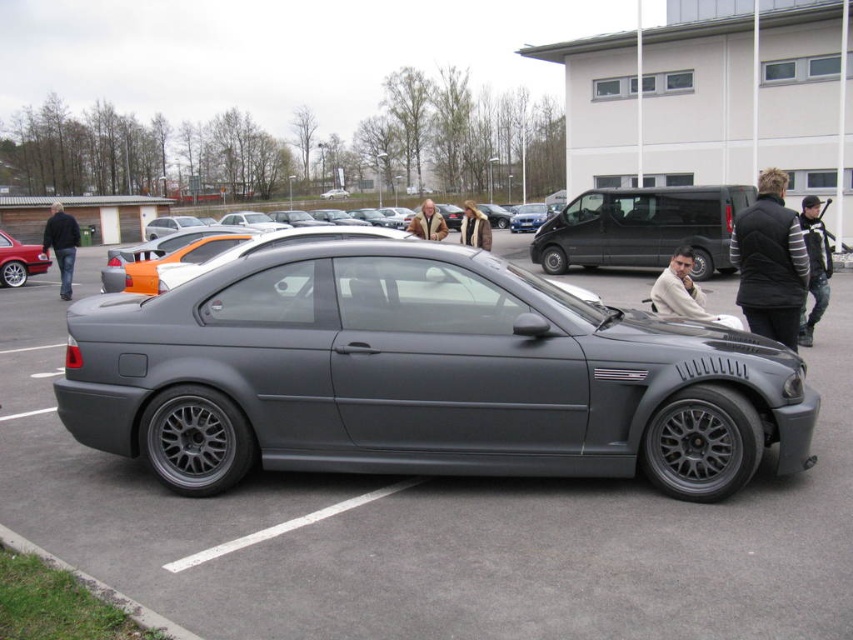
Question: Which point is farther to the camera?

Choices:
 (A) black quilted vest at right
 (B) matte black van at center
 (C) brown fur coat at center
 (D) matte gray car at center

Answer: (B)

Question: Does light beige sweater at center have a smaller size compared to matte black car at center?

Choices:
 (A) yes
 (B) no

Answer: (A)

Question: Which of these objects is positioned farthest from the black matte license plate at center?

Choices:
 (A) matte gray car at center
 (B) brown fur coat at center
 (C) striped sweater at right

Answer: (A)

Question: Which point is closer to the camera?

Choices:
 (A) black matte license plate at center
 (B) matte gray car at center
 (C) dark gray leather jacket at left
 (D) matte black van at center

Answer: (B)

Question: Is striped sweater at right to the right of dark gray leather jacket at left from the viewer's perspective?

Choices:
 (A) no
 (B) yes

Answer: (B)

Question: Is dark gray leather jacket at left above matte black car at center?

Choices:
 (A) no
 (B) yes

Answer: (B)